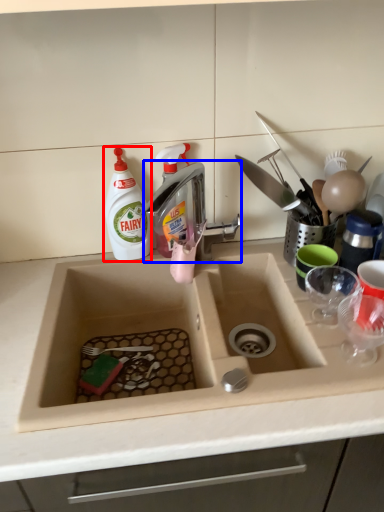
Question: Which object is further to the camera taking this photo, cleaning product (highlighted by a red box) or tap (highlighted by a blue box)?

Choices:
 (A) cleaning product
 (B) tap

Answer: (A)